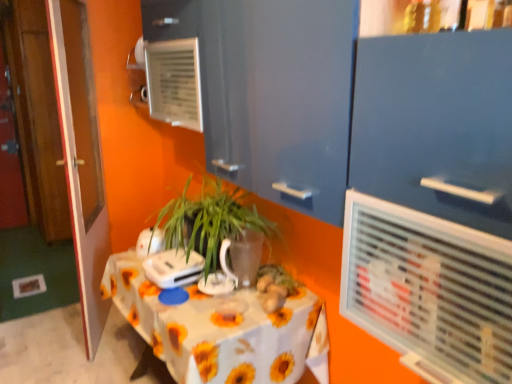
Question: In terms of height, does white plastic air conditioning unit at upper center look taller or shorter compared to matte blue cabinet at upper center?

Choices:
 (A) tall
 (B) short

Answer: (B)

Question: Is point (421, 286) closer or farther from the camera than point (480, 51)?

Choices:
 (A) farther
 (B) closer

Answer: (A)

Question: Which is farther from the translucent glass vase at center?

Choices:
 (A) matte blue cabinet at upper center
 (B) white plastic air conditioning unit at upper center
 (C) white glossy kettle at upper center, placed as the 2th appliance when sorted from front to back
 (D) white glossy table at center
 (E) white plastic appliance at center, arranged as the 1th appliance when viewed from the front

Answer: (A)

Question: Which is nearer to the green leafy plant at center?

Choices:
 (A) translucent glass vase at center
 (B) wooden door at left
 (C) white plastic appliance at center, the 2th appliance viewed from the back
 (D) white glossy kettle at upper center, placed as the 2th appliance when sorted from front to back
 (E) matte blue cabinet at upper center

Answer: (C)